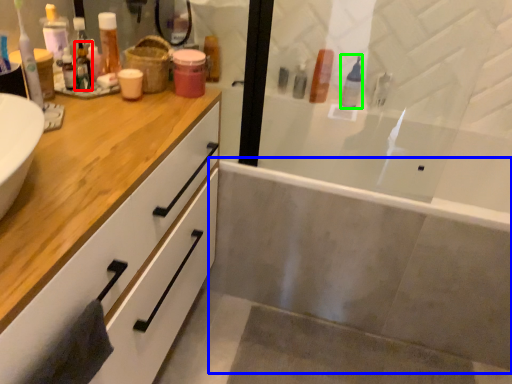
Question: Which is nearer to the toiletry (highlighted by a red box)? bath (highlighted by a blue box) or toiletry (highlighted by a green box).

Choices:
 (A) bath
 (B) toiletry

Answer: (B)